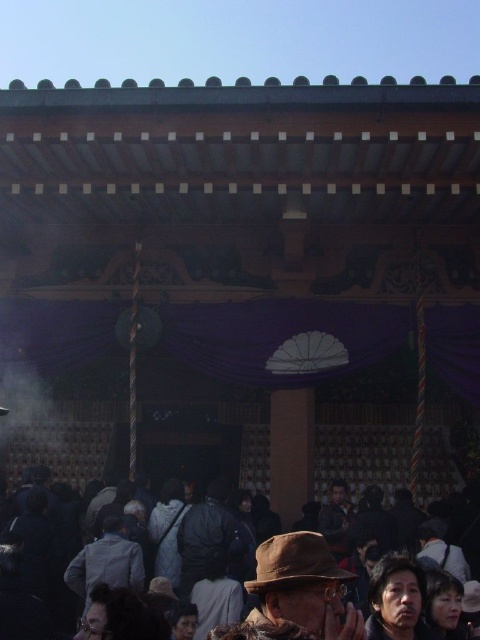
You are a photographer trying to capture a photo of the dark brown fabric crowd at lower center and the dark brown leather hat at lower center. Which object will appear wider in the photo?

The dark brown fabric crowd at lower center will appear wider in the photo because its width is larger than the dark brown leather hat at lower center.

You are standing in front of the shrine and want to take a photo of the dark brown leather hat at lower center and the dark gray fabric jacket at center. Which object will appear larger in the photo?

The dark brown leather hat at lower center will appear larger in the photo because it is closer to the viewer than the dark gray fabric jacket at center.